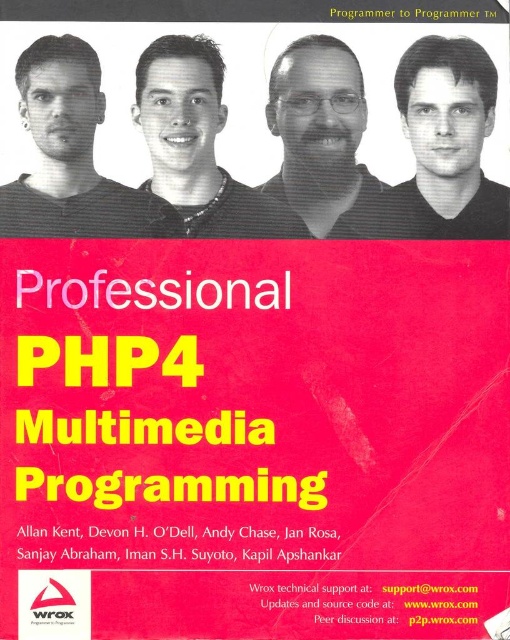
Is matte black face at upper left shorter than matte black face at center?

Yes.

Is point (27, 74) in front of point (221, 77)?

That is True.

The image size is (510, 640). I want to click on matte black face at upper left, so click(x=71, y=156).

Between point (42, 102) and point (336, 125), which one is positioned behind?

Point (336, 125)

Between matte black face at upper left and matte black shirt at center, which one appears on the left side from the viewer's perspective?

From the viewer's perspective, matte black face at upper left appears more on the left side.

Does point (83, 104) come closer to viewer compared to point (333, 99)?

Yes, point (83, 104) is in front of point (333, 99).

The image size is (510, 640). Identify the location of matte black face at upper left. (71, 156).

Who is more distant from viewer, (178, 209) or (262, 189)?

Point (262, 189)

Between point (161, 179) and point (355, 61), which one is positioned behind?

Positioned behind is point (161, 179).

This screenshot has width=510, height=640. In order to click on matte black face at center in this screenshot , I will do `click(197, 145)`.